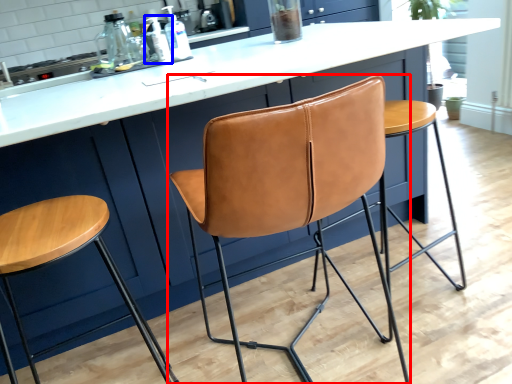
Question: Which point is closer to the camera, chair (highlighted by a red box) or bottle (highlighted by a blue box)?

Choices:
 (A) chair
 (B) bottle

Answer: (A)